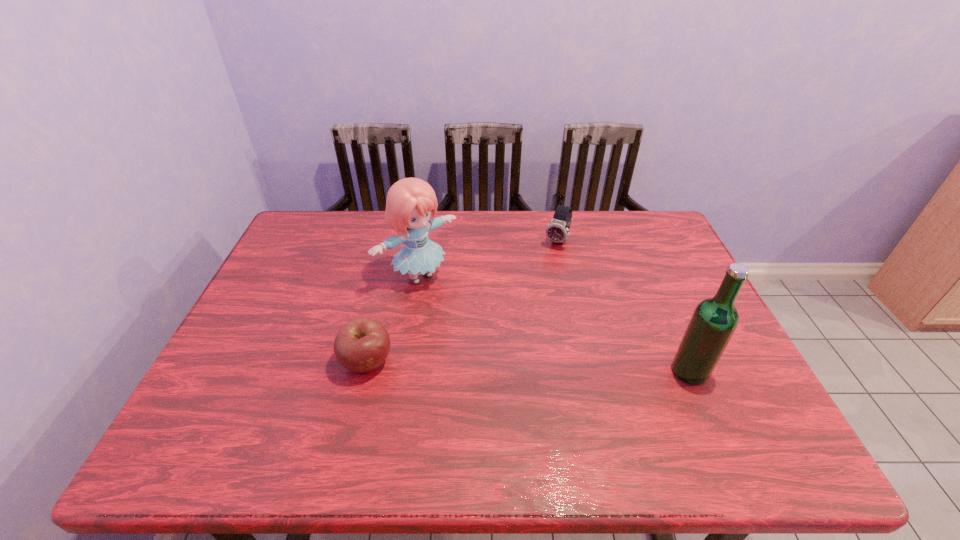
The height and width of the screenshot is (540, 960). In the image, there is a desktop. Find the location of `vacant space at the far left corner`. vacant space at the far left corner is located at coordinates (324, 230).

In the image, there is a desktop. Identify the location of vacant space at the far right corner. This screenshot has height=540, width=960. (617, 213).

Locate an element on the screen. This screenshot has width=960, height=540. free point between the third object from left to right and the beer bottle is located at coordinates (623, 306).

The image size is (960, 540). In order to click on vacant space that is in between the beer bottle and the second object from right to left in this screenshot , I will do `click(623, 306)`.

Identify the location of free spot between the beer bottle and the second shortest object. This screenshot has height=540, width=960. (623, 306).

This screenshot has height=540, width=960. I want to click on free spot between the rightmost object and the third tallest object, so click(x=623, y=306).

This screenshot has height=540, width=960. Find the location of `vacant point located between the rightmost object and the second shortest object`. vacant point located between the rightmost object and the second shortest object is located at coordinates (623, 306).

Where is `free space between the beer bottle and the shortest object`? Image resolution: width=960 pixels, height=540 pixels. free space between the beer bottle and the shortest object is located at coordinates (529, 367).

Find the location of `empty space that is in between the shortest object and the rightmost object`. empty space that is in between the shortest object and the rightmost object is located at coordinates (529, 367).

Find the location of a particular element. The height and width of the screenshot is (540, 960). free space between the shortest object and the third nearest object is located at coordinates (393, 319).